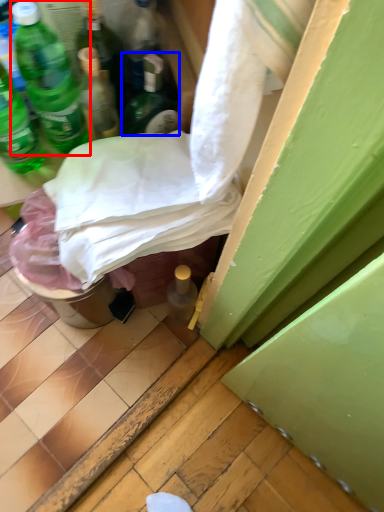
Question: Which object is further to the camera taking this photo, bottle (highlighted by a red box) or bottle (highlighted by a blue box)?

Choices:
 (A) bottle
 (B) bottle

Answer: (B)